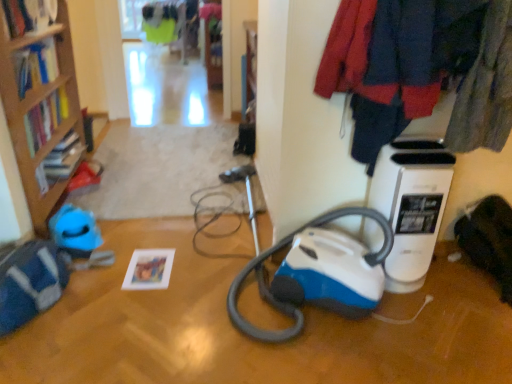
Question: Is hardcover book at upper left, which is the third book in right-to-left order, in front of or behind white plastic air purifier at right in the image?

Choices:
 (A) front
 (B) behind

Answer: (B)

Question: Would you say hardcover book at upper left, the first book positioned from the left, is to the left or to the right of white plastic air purifier at right in the picture?

Choices:
 (A) left
 (B) right

Answer: (A)

Question: Considering the real-world distances, which object is closest to the velvet-like fabric coat at upper right?

Choices:
 (A) matte paper photo frame at lower left, which is counted as the first book, starting from the bottom
 (B) wooden bookcase at left
 (C) hardcover book at upper left, which is counted as the third book, starting from the bottom
 (D) hardcover book at left, the second book when ordered from top to bottom
 (E) white plastic air purifier at right

Answer: (E)

Question: Based on their relative distances, which object is farther from the hardcover book at left, placed as the second book when sorted from bottom to top?

Choices:
 (A) wooden bookcase at left
 (B) velvet-like fabric coat at upper right
 (C) hardcover book at upper left, which is the 1th book in top-to-bottom order
 (D) matte paper photo frame at lower left, placed as the first book when sorted from right to left
 (E) white plastic air purifier at right

Answer: (E)